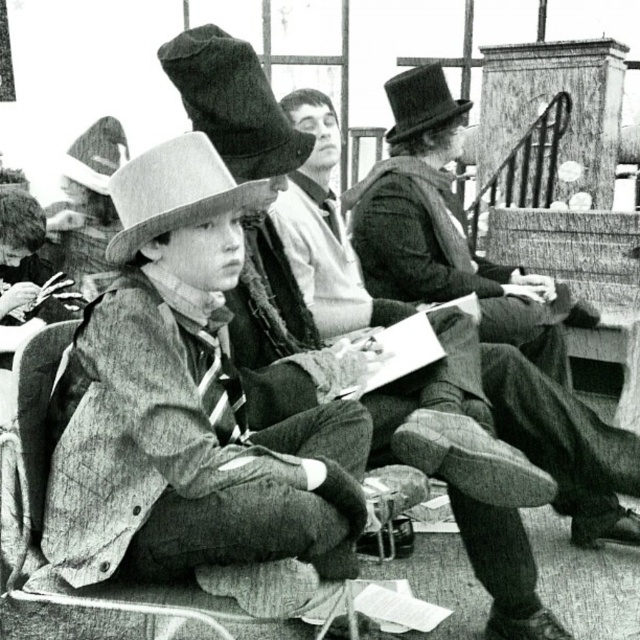
Can you confirm if smooth wool coat at center is wider than matte gray dress hat at center?

Indeed, smooth wool coat at center has a greater width compared to matte gray dress hat at center.

The image size is (640, 640). What do you see at coordinates (448, 230) in the screenshot?
I see `smooth wool coat at center` at bounding box center [448, 230].

What do you see at coordinates (448, 230) in the screenshot?
I see `smooth wool coat at center` at bounding box center [448, 230].

The image size is (640, 640). What are the coordinates of `smooth wool coat at center` in the screenshot? It's located at [x=448, y=230].

Who is positioned more to the left, matte gray dress hat at center or wooden chair at center?

From the viewer's perspective, matte gray dress hat at center appears more on the left side.

This screenshot has width=640, height=640. What do you see at coordinates (173, 193) in the screenshot?
I see `matte gray dress hat at center` at bounding box center [173, 193].

Where is `matte gray dress hat at center`? This screenshot has height=640, width=640. matte gray dress hat at center is located at coordinates (173, 193).

Image resolution: width=640 pixels, height=640 pixels. Describe the element at coordinates (561, 438) in the screenshot. I see `smooth black coat at center` at that location.

Does smooth black coat at center have a greater height compared to soft felt dress hat at upper center?

Indeed, smooth black coat at center has a greater height compared to soft felt dress hat at upper center.

In order to click on smooth black coat at center in this screenshot , I will do `click(561, 438)`.